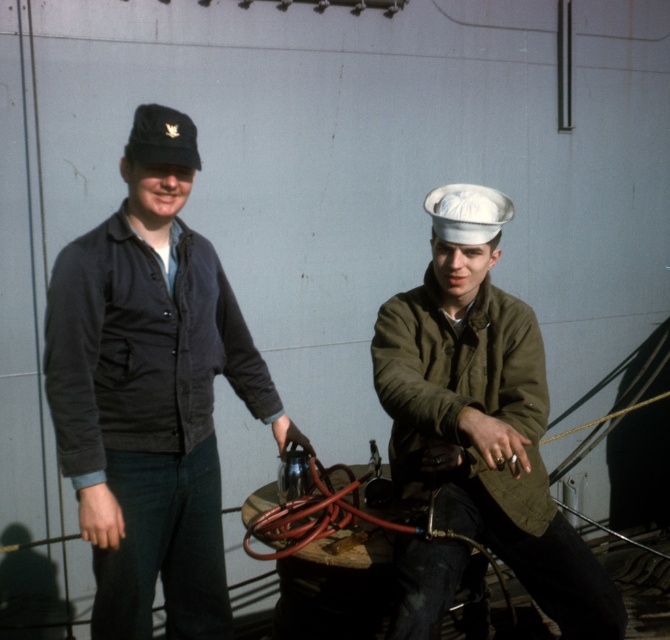
Does dark gray corduroy jacket at left appear on the right side of black matte cap at upper left?

Indeed, dark gray corduroy jacket at left is positioned on the right side of black matte cap at upper left.

Does dark gray corduroy jacket at left have a smaller size compared to black matte cap at upper left?

No, dark gray corduroy jacket at left is not smaller than black matte cap at upper left.

This screenshot has height=640, width=670. What are the coordinates of `dark gray corduroy jacket at left` in the screenshot? It's located at (149, 404).

Who is lower down, dark gray corduroy jacket at left or khaki woolen jacket at right?

khaki woolen jacket at right

Looking at this image, can you confirm if dark gray corduroy jacket at left is positioned below khaki woolen jacket at right?

No, dark gray corduroy jacket at left is not below khaki woolen jacket at right.

Which is in front, point (210, 348) or point (405, 586)?

Point (405, 586) is in front.

Locate an element on the screen. This screenshot has height=640, width=670. dark gray corduroy jacket at left is located at coordinates (149, 404).

Who is more forward, [425,492] or [474,198]?

Point [474,198] is in front.

Between olive green woolen jacket at right and white matte hat at center, which one has less height?

Standing shorter between the two is white matte hat at center.

Describe the element at coordinates (464, 390) in the screenshot. I see `olive green woolen jacket at right` at that location.

Where is `olive green woolen jacket at right`? The image size is (670, 640). olive green woolen jacket at right is located at coordinates (464, 390).